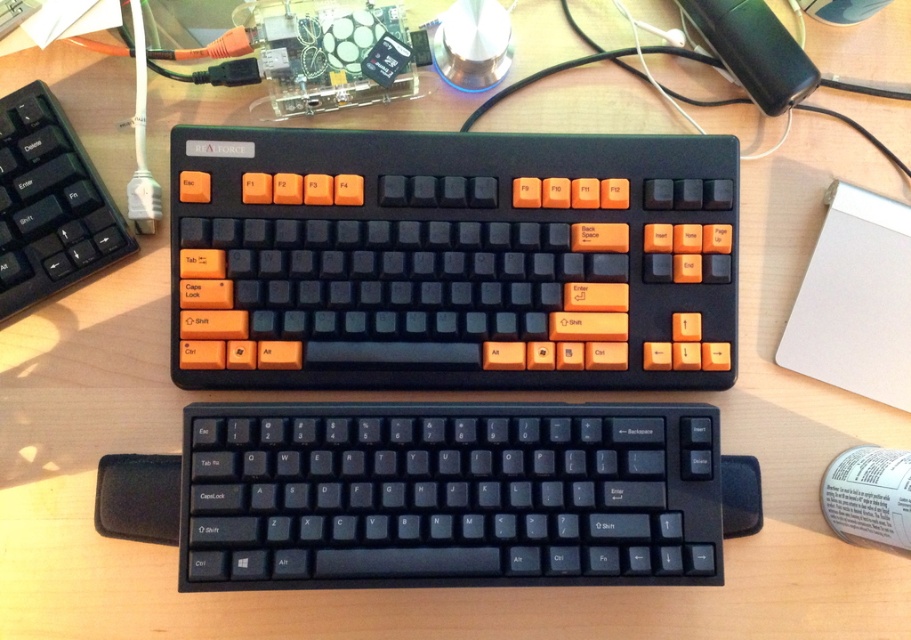
Who is taller, matte black keyboard at center or black plastic keyboard at center?

Standing taller between the two is matte black keyboard at center.

Does matte black keyboard at center appear on the right side of black plastic keyboard at center?

Correct, you'll find matte black keyboard at center to the right of black plastic keyboard at center.

Does point (213, 246) lie behind point (551, 552)?

Yes, point (213, 246) is farther from viewer.

Find the location of `matte black keyboard at center`. matte black keyboard at center is located at coordinates (451, 259).

Does black plastic keyboard at center have a larger size compared to matte black keyboard at left?

Indeed, black plastic keyboard at center has a larger size compared to matte black keyboard at left.

Does black plastic keyboard at center appear on the right side of matte black keyboard at left?

Indeed, black plastic keyboard at center is positioned on the right side of matte black keyboard at left.

The image size is (911, 640). Identify the location of black plastic keyboard at center. (448, 493).

Identify the location of black plastic keyboard at center. This screenshot has height=640, width=911. (448, 493).

Does matte black keyboard at center have a lesser height compared to matte black keyboard at left?

In fact, matte black keyboard at center may be taller than matte black keyboard at left.

What do you see at coordinates (451, 259) in the screenshot? I see `matte black keyboard at center` at bounding box center [451, 259].

Find the location of a particular element. matte black keyboard at center is located at coordinates (451, 259).